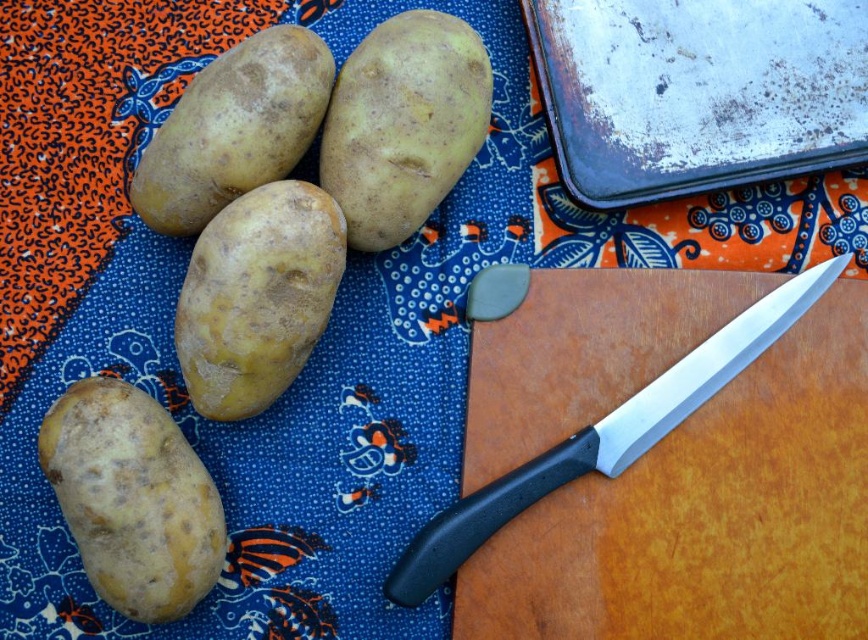
Does yellow matte potato at center have a greater width compared to smooth yellow potato at center?

No, yellow matte potato at center is not wider than smooth yellow potato at center.

Is yellow matte potato at center to the left of smooth yellow potato at center from the viewer's perspective?

Correct, you'll find yellow matte potato at center to the left of smooth yellow potato at center.

Does point (255, 232) come in front of point (343, 128)?

Yes, point (255, 232) is closer to viewer.

Locate an element on the screen. The image size is (868, 640). yellow matte potato at center is located at coordinates (257, 296).

Which is behind, point (231, 330) or point (287, 140)?

The point (287, 140) is more distant.

Can you confirm if yellow matte potato at center is bigger than matte yellow potato at upper left?

Yes.

Measure the distance between point (275, 269) and camera.

Point (275, 269) is 1.23 meters from camera.

Identify the location of yellow matte potato at center. The height and width of the screenshot is (640, 868). (257, 296).

Can you confirm if rusty metal tray at upper right is shorter than smooth yellow potato at lower left?

Yes.

Who is more forward, (858, 115) or (51, 417)?

Positioned in front is point (51, 417).

Between point (842, 136) and point (132, 560), which one is positioned behind?

Positioned behind is point (842, 136).

Where is `rusty metal tray at upper right`? rusty metal tray at upper right is located at coordinates (696, 92).